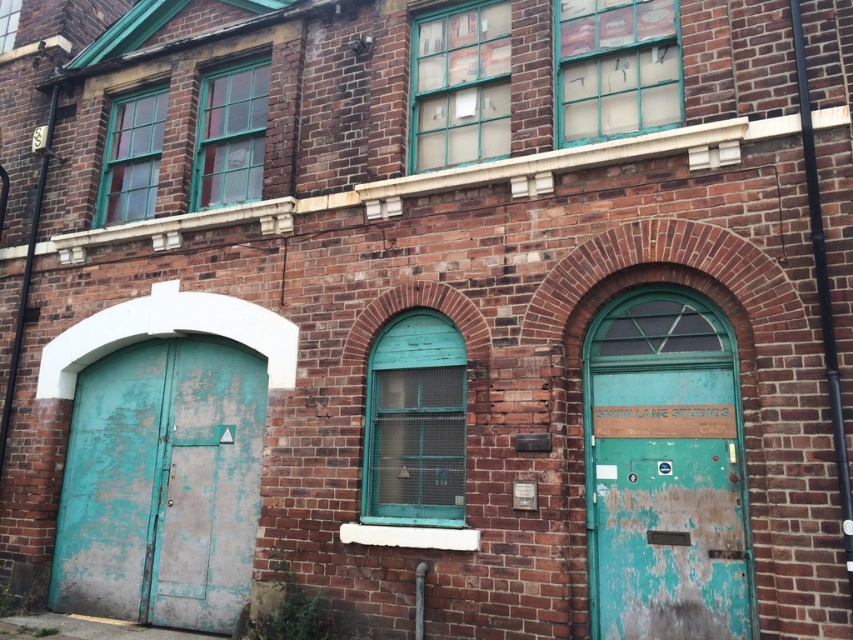
Between peeling teal metal door at left and peeling teal paint door at center right, which one is positioned higher?

peeling teal paint door at center right is above.

Is peeling teal metal door at left taller than peeling teal paint door at center right?

Indeed, peeling teal metal door at left has a greater height compared to peeling teal paint door at center right.

Which is in front, point (200, 477) or point (712, 448)?

Point (712, 448)

The height and width of the screenshot is (640, 853). I want to click on peeling teal metal door at left, so click(161, 484).